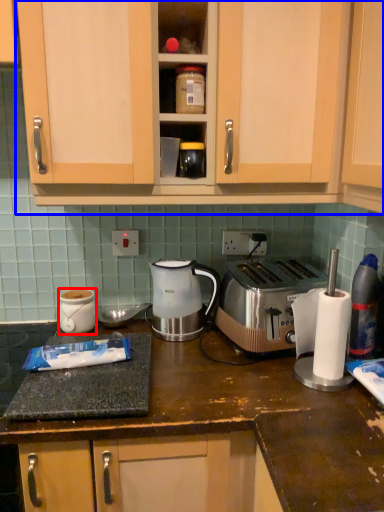
Question: Which object appears closest to the camera in this image, appliance (highlighted by a red box) or cabinetry (highlighted by a blue box)?

Choices:
 (A) appliance
 (B) cabinetry

Answer: (B)